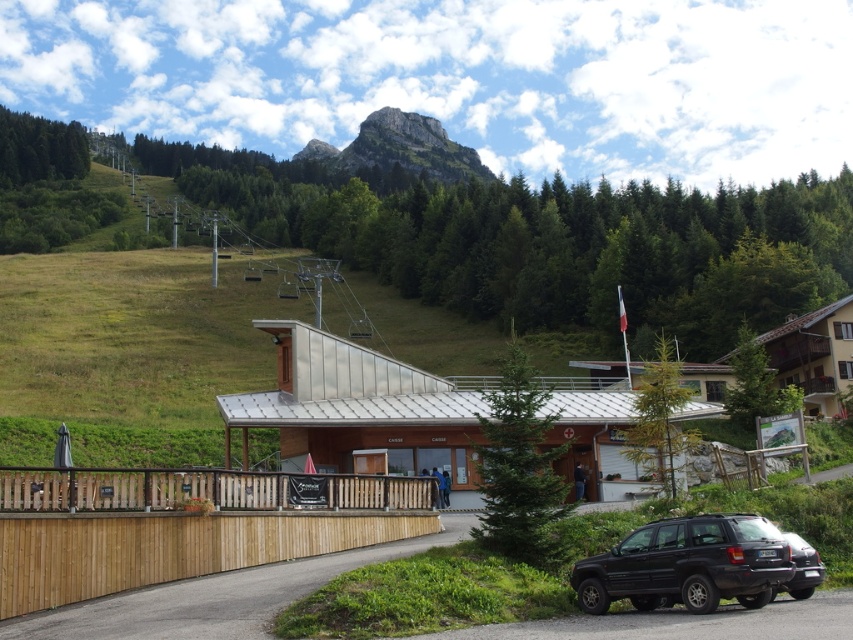
You are planning to park your car in the parking lot near the black matte suv at lower right and the metallic silver ski lift at upper center. Which vehicle has a smaller size?

The black matte suv at lower right has a smaller size compared to the metallic silver ski lift at upper center.